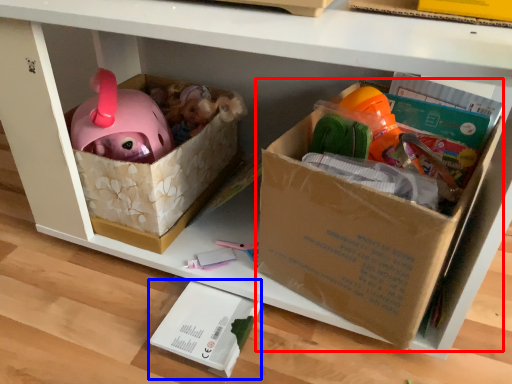
Question: Which of the following is the farthest to the observer, cardboard box (highlighted by a red box) or box (highlighted by a blue box)?

Choices:
 (A) cardboard box
 (B) box

Answer: (B)